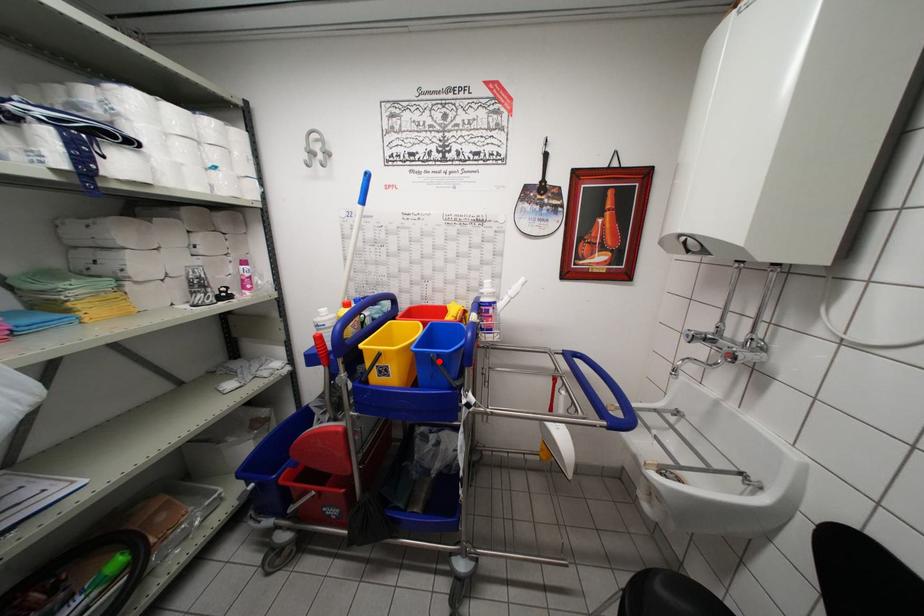
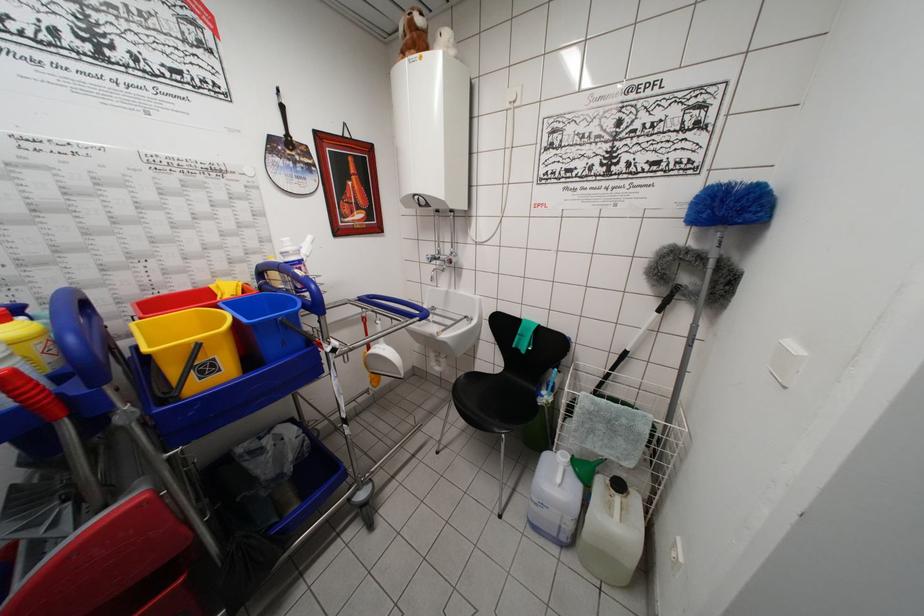
Where in the second image is the point corresponding to the highlighted location from the first image?

(287, 323)